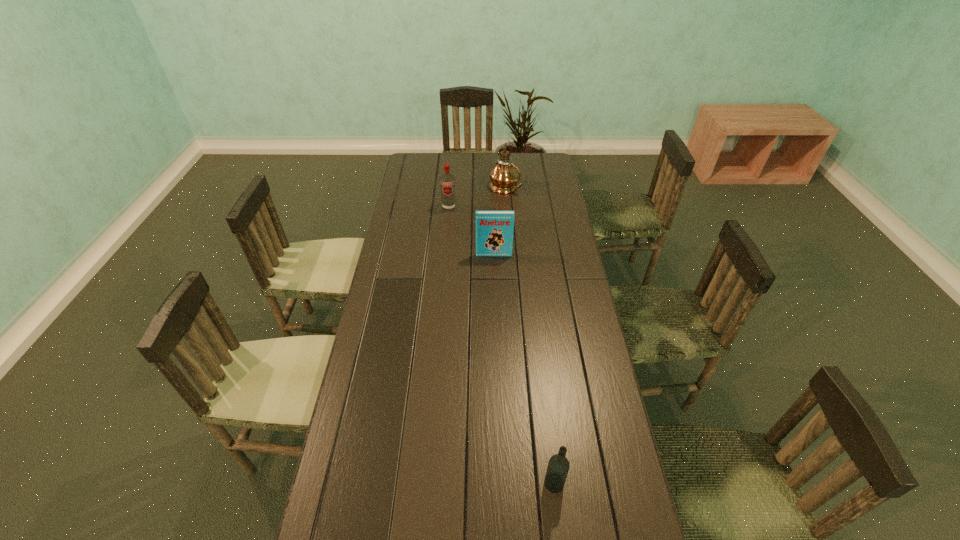
Locate an element on the screen. Image resolution: width=960 pixels, height=540 pixels. free space located on the left of the shorter vodka is located at coordinates (408, 483).

The image size is (960, 540). I want to click on blank space at the far edge of the desktop, so click(489, 156).

What are the coordinates of `blank space at the left edge of the desktop` in the screenshot? It's located at (431, 208).

In the image, there is a desktop. In order to click on vacant space at the right edge in this screenshot , I will do `click(540, 190)`.

This screenshot has width=960, height=540. In order to click on vacant space in between the farthest object and the right vodka in this screenshot , I will do `click(529, 335)`.

Find the location of a particular element. free point between the tallest object and the nearest object is located at coordinates click(x=529, y=335).

Where is `vacant area between the farthest object and the taller vodka`? The height and width of the screenshot is (540, 960). vacant area between the farthest object and the taller vodka is located at coordinates (477, 198).

Locate an element on the screen. Image resolution: width=960 pixels, height=540 pixels. object identified as the closest to the farther vodka is located at coordinates (504, 177).

The height and width of the screenshot is (540, 960). In order to click on object that is the third closest to the taller vodka in this screenshot , I will do `click(558, 466)`.

In order to click on free space that satisfies the following two spatial constraints: 1. on the front label of the right vodka; 2. on the right side of the leftmost object in this screenshot , I will do `click(425, 483)`.